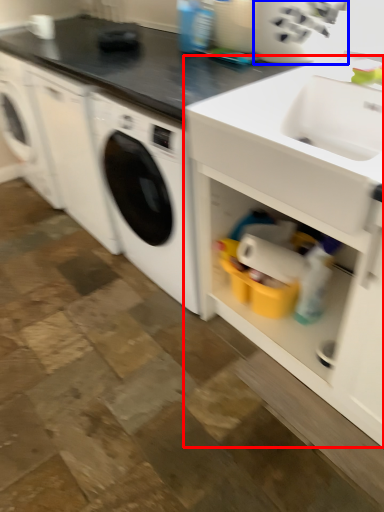
Question: Which of the following is the farthest to the observer, cabinetry (highlighted by a red box) or appliance (highlighted by a blue box)?

Choices:
 (A) cabinetry
 (B) appliance

Answer: (B)